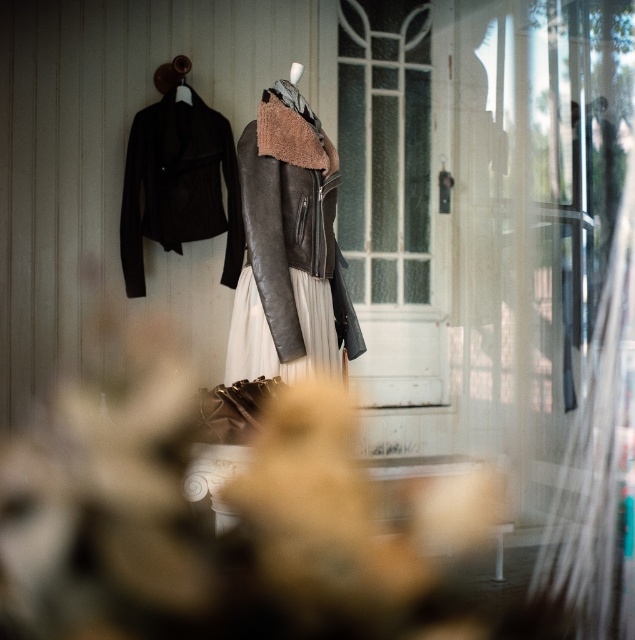
Question: Can you confirm if leather jacket at center is positioned to the right of matte black leather jacket at left?

Choices:
 (A) no
 (B) yes

Answer: (B)

Question: Does matte black leather jacket at center appear over matte black leather jacket at left?

Choices:
 (A) yes
 (B) no

Answer: (A)

Question: Which point is closer to the camera?

Choices:
 (A) leather dress at center
 (B) matte black leather jacket at center

Answer: (A)

Question: Considering the real-world distances, which object is closest to the matte black leather jacket at center?

Choices:
 (A) leather jacket at center
 (B) leather dress at center
 (C) matte black leather jacket at left

Answer: (C)

Question: Which object is closer to the camera taking this photo?

Choices:
 (A) matte black leather jacket at center
 (B) matte black leather jacket at left
 (C) leather dress at center

Answer: (C)

Question: Can you confirm if matte black leather jacket at center is smaller than leather dress at center?

Choices:
 (A) no
 (B) yes

Answer: (A)